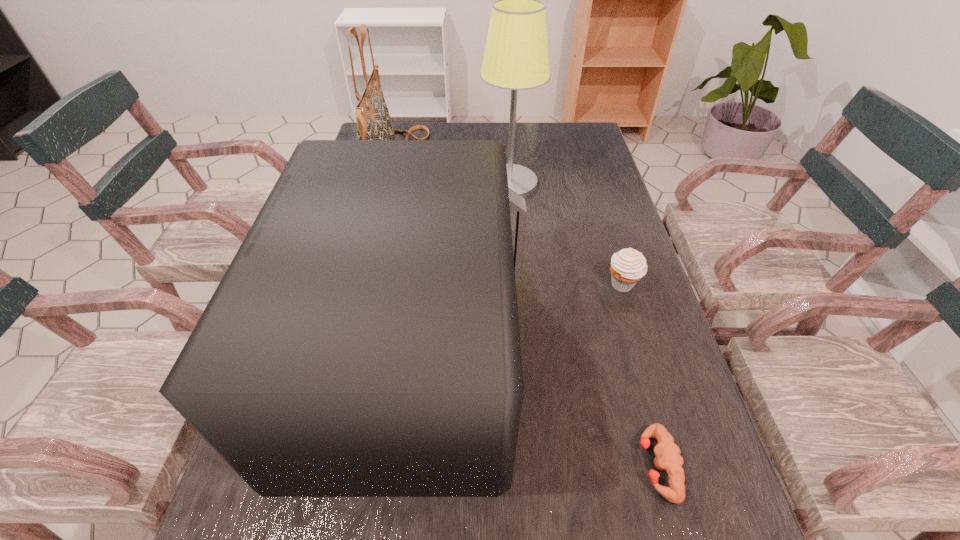
The height and width of the screenshot is (540, 960). Identify the location of free space between the puncher and the second shortest object. (639, 375).

Identify the location of vacant point located between the shortest object and the microwave oven. The width and height of the screenshot is (960, 540). (533, 409).

Identify the location of vacant space in between the puncher and the third shortest object. (533, 409).

The height and width of the screenshot is (540, 960). In order to click on free area in between the puncher and the handbag in this screenshot , I will do `click(526, 312)`.

Where is `the second closest object relative to the fourth shortest object`? The width and height of the screenshot is (960, 540). the second closest object relative to the fourth shortest object is located at coordinates (364, 341).

Find the location of a particular element. This screenshot has height=540, width=960. object that ranks as the fourth closest to the shortest object is located at coordinates (373, 119).

Locate an element on the screen. vacant space that satisfies the following two spatial constraints: 1. on the front side of the fourth tallest object; 2. on the right side of the table lamp is located at coordinates (517, 285).

Find the location of a particular element. vacant space that satisfies the following two spatial constraints: 1. on the front-facing side of the fourth shortest object; 2. on the left side of the tallest object is located at coordinates (389, 183).

I want to click on vacant point that satisfies the following two spatial constraints: 1. on the front-facing side of the second tallest object; 2. on the left side of the second shortest object, so click(x=363, y=285).

Where is `free spot that satisfies the following two spatial constraints: 1. on the front side of the second shortest object; 2. on the front-facing side of the third tallest object`? free spot that satisfies the following two spatial constraints: 1. on the front side of the second shortest object; 2. on the front-facing side of the third tallest object is located at coordinates (643, 352).